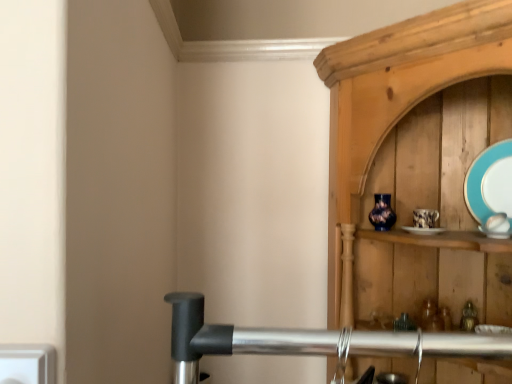
Question: Is white plastic electric outlet at lower left to the right of teal glossy plate at upper right from the viewer's perspective?

Choices:
 (A) no
 (B) yes

Answer: (A)

Question: From a real-world perspective, is white plastic electric outlet at lower left beneath teal glossy plate at upper right?

Choices:
 (A) yes
 (B) no

Answer: (A)

Question: Are white plastic electric outlet at lower left and teal glossy plate at upper right making contact?

Choices:
 (A) yes
 (B) no

Answer: (B)

Question: Is white plastic electric outlet at lower left thinner than teal glossy plate at upper right?

Choices:
 (A) yes
 (B) no

Answer: (B)

Question: Could teal glossy plate at upper right be considered to be inside white plastic electric outlet at lower left?

Choices:
 (A) no
 (B) yes

Answer: (A)

Question: From a real-world perspective, is white plastic electric outlet at lower left located higher than teal glossy plate at upper right?

Choices:
 (A) no
 (B) yes

Answer: (A)

Question: From the image's perspective, is teal glossy plate at upper right below white plastic electric outlet at lower left?

Choices:
 (A) no
 (B) yes

Answer: (A)

Question: Can you confirm if teal glossy plate at upper right is positioned to the right of white plastic electric outlet at lower left?

Choices:
 (A) yes
 (B) no

Answer: (A)

Question: From a real-world perspective, does teal glossy plate at upper right stand above white plastic electric outlet at lower left?

Choices:
 (A) yes
 (B) no

Answer: (A)

Question: Is teal glossy plate at upper right located outside white plastic electric outlet at lower left?

Choices:
 (A) no
 (B) yes

Answer: (B)

Question: Would you say white plastic electric outlet at lower left is part of teal glossy plate at upper right's contents?

Choices:
 (A) yes
 (B) no

Answer: (B)

Question: Can you confirm if teal glossy plate at upper right is bigger than white plastic electric outlet at lower left?

Choices:
 (A) yes
 (B) no

Answer: (A)

Question: In terms of width, does teal glossy plate at upper right look wider or thinner when compared to white plastic electric outlet at lower left?

Choices:
 (A) thin
 (B) wide

Answer: (A)